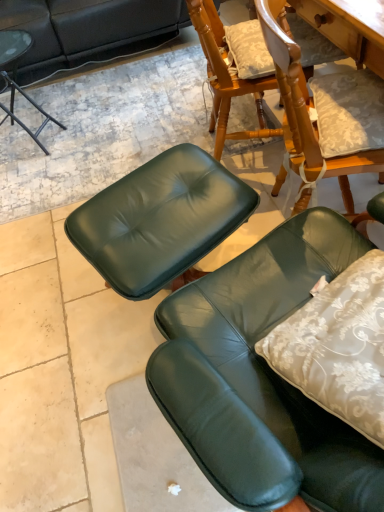
The height and width of the screenshot is (512, 384). What do you see at coordinates (261, 377) in the screenshot? I see `green leather chair at lower right, positioned as the first chair in right-to-left order` at bounding box center [261, 377].

In order to click on green leather chair at lower right, marked as the second chair in a left-to-right arrangement in this screenshot , I will do `click(261, 377)`.

The height and width of the screenshot is (512, 384). In order to click on matte black side table at upper left, which is the 2th chair from bottom to top in this screenshot , I will do `click(15, 77)`.

This screenshot has height=512, width=384. What do you see at coordinates (15, 77) in the screenshot? I see `matte black side table at upper left, marked as the first chair in a back-to-front arrangement` at bounding box center [15, 77].

The image size is (384, 512). Identify the location of green leather chair at lower right, which appears as the 2th chair when viewed from the back. (261, 377).

Does green leather chair at lower right, marked as the second chair in a left-to-right arrangement, appear on the right side of matte black side table at upper left, the 1th chair when ordered from left to right?

Yes.

Relative to matte black side table at upper left, positioned as the first chair in top-to-bottom order, is green leather chair at lower right, the 1th chair from the bottom, in front or behind?

Visually, green leather chair at lower right, the 1th chair from the bottom, is located in front of matte black side table at upper left, positioned as the first chair in top-to-bottom order.

Does point (300, 433) lie in front of point (21, 89)?

Yes, it is in front of point (21, 89).

In the scene shown: From the image's perspective, which is below, green leather chair at lower right, the 1th chair from the bottom, or matte black side table at upper left, the 1th chair when ordered from left to right?

From the image's view, green leather chair at lower right, the 1th chair from the bottom, is below.

From a real-world perspective, relative to matte black side table at upper left, marked as the first chair in a back-to-front arrangement, is green leather chair at lower right, marked as the second chair in a left-to-right arrangement, vertically above or below?

green leather chair at lower right, marked as the second chair in a left-to-right arrangement, is above matte black side table at upper left, marked as the first chair in a back-to-front arrangement.

Consider the image. Does green leather chair at lower right, marked as the second chair in a left-to-right arrangement, have a lesser width compared to matte black side table at upper left, marked as the second chair in a right-to-left arrangement?

Correct, the width of green leather chair at lower right, marked as the second chair in a left-to-right arrangement, is less than that of matte black side table at upper left, marked as the second chair in a right-to-left arrangement.

Who is taller, green leather chair at lower right, the 1th chair from the bottom, or matte black side table at upper left, which is the 2th chair from bottom to top?

green leather chair at lower right, the 1th chair from the bottom, is taller.

Is green leather chair at lower right, which is the 2th chair from top to bottom, smaller than matte black side table at upper left, which appears as the 2th chair when viewed from the front?

Correct, green leather chair at lower right, which is the 2th chair from top to bottom, occupies less space than matte black side table at upper left, which appears as the 2th chair when viewed from the front.

Is green leather chair at lower right, positioned as the first chair in right-to-left order, surrounding matte black side table at upper left, which appears as the 2th chair when viewed from the front?

No, green leather chair at lower right, positioned as the first chair in right-to-left order, does not contain matte black side table at upper left, which appears as the 2th chair when viewed from the front.

Is green leather chair at lower right, which is the 2th chair from top to bottom, beside matte black side table at upper left, which is the 2th chair from bottom to top?

There is a gap between green leather chair at lower right, which is the 2th chair from top to bottom, and matte black side table at upper left, which is the 2th chair from bottom to top.

Is green leather chair at lower right, which is the 2th chair from top to bottom, facing towards matte black side table at upper left, marked as the first chair in a back-to-front arrangement?

Yes, green leather chair at lower right, which is the 2th chair from top to bottom, is oriented towards matte black side table at upper left, marked as the first chair in a back-to-front arrangement.

How different are the orientations of green leather chair at lower right, the 1th chair from the bottom, and matte black side table at upper left, marked as the first chair in a back-to-front arrangement, in degrees?

The angular difference between green leather chair at lower right, the 1th chair from the bottom, and matte black side table at upper left, marked as the first chair in a back-to-front arrangement, is 69.9 degrees.

Measure the distance between green leather chair at lower right, which is the 2th chair from top to bottom, and matte black side table at upper left, which appears as the 2th chair when viewed from the front.

A distance of 5.89 feet exists between green leather chair at lower right, which is the 2th chair from top to bottom, and matte black side table at upper left, which appears as the 2th chair when viewed from the front.

You are a GUI agent. You are given a task and a screenshot of the screen. Output one action in this format:
    pyautogui.click(x=<x>, y=<y>)
    Task: Click on the chair above the green leather chair at lower right, marked as the second chair in a left-to-right arrangement (from the image's perspective)
    
    Given the screenshot: What is the action you would take?
    pyautogui.click(x=15, y=77)

From the picture: Which is more to the right, matte black side table at upper left, marked as the first chair in a back-to-front arrangement, or green leather chair at lower right, marked as the second chair in a left-to-right arrangement?

Positioned to the right is green leather chair at lower right, marked as the second chair in a left-to-right arrangement.

Relative to green leather chair at lower right, marked as the second chair in a left-to-right arrangement, is matte black side table at upper left, which appears as the 2th chair when viewed from the front, in front or behind?

Visually, matte black side table at upper left, which appears as the 2th chair when viewed from the front, is located behind green leather chair at lower right, marked as the second chair in a left-to-right arrangement.

Which is less distant, (12, 108) or (184, 294)?

Point (12, 108) is farther from the camera than point (184, 294).

From the picture: From the image's perspective, who appears lower, matte black side table at upper left, which appears as the 2th chair when viewed from the front, or green leather chair at lower right, marked as the second chair in a left-to-right arrangement?

green leather chair at lower right, marked as the second chair in a left-to-right arrangement, is shown below in the image.

From a real-world perspective, is matte black side table at upper left, marked as the first chair in a back-to-front arrangement, physically located above or below green leather chair at lower right, the 1th chair from the bottom?

Clearly, from a real-world perspective, matte black side table at upper left, marked as the first chair in a back-to-front arrangement, is below green leather chair at lower right, the 1th chair from the bottom.

Looking at their sizes, would you say matte black side table at upper left, marked as the first chair in a back-to-front arrangement, is wider or thinner than green leather chair at lower right, marked as the second chair in a left-to-right arrangement?

Considering their sizes, matte black side table at upper left, marked as the first chair in a back-to-front arrangement, looks broader than green leather chair at lower right, marked as the second chair in a left-to-right arrangement.

Which of these two, matte black side table at upper left, which is the 2th chair from bottom to top, or green leather chair at lower right, the 1th chair from the bottom, stands taller?

green leather chair at lower right, the 1th chair from the bottom.

Who is smaller, matte black side table at upper left, which appears as the 2th chair when viewed from the front, or green leather chair at lower right, which appears as the 2th chair when viewed from the back?

green leather chair at lower right, which appears as the 2th chair when viewed from the back, is smaller.

Is matte black side table at upper left, positioned as the first chair in top-to-bottom order, not inside green leather chair at lower right, which appears as the 2th chair when viewed from the back?

Absolutely, matte black side table at upper left, positioned as the first chair in top-to-bottom order, is external to green leather chair at lower right, which appears as the 2th chair when viewed from the back.

Is matte black side table at upper left, positioned as the first chair in top-to-bottom order, in contact with green leather chair at lower right, marked as the second chair in a left-to-right arrangement?

No.

Is matte black side table at upper left, which appears as the 2th chair when viewed from the front, oriented away from green leather chair at lower right, the 1th chair from the bottom?

No.

How many degrees apart are the facing directions of matte black side table at upper left, marked as the first chair in a back-to-front arrangement, and green leather chair at lower right, positioned as the first chair in right-to-left order?

69.9 degrees.

Could you measure the distance between matte black side table at upper left, positioned as the first chair in top-to-bottom order, and green leather chair at lower right, the 1th chair from the bottom?

The distance of matte black side table at upper left, positioned as the first chair in top-to-bottom order, from green leather chair at lower right, the 1th chair from the bottom, is 1.80 meters.

Where is `chair above the green leather chair at lower right, which appears as the 2th chair when viewed from the back (from the image's perspective)`? chair above the green leather chair at lower right, which appears as the 2th chair when viewed from the back (from the image's perspective) is located at coordinates (15, 77).

What are the coordinates of `chair that appears below the green leather chair at lower right, which is the first chair from front to back (from a real-world perspective)` in the screenshot? It's located at (15, 77).

The height and width of the screenshot is (512, 384). Find the location of `chair below the matte black side table at upper left, marked as the second chair in a right-to-left arrangement (from the image's perspective)`. chair below the matte black side table at upper left, marked as the second chair in a right-to-left arrangement (from the image's perspective) is located at coordinates (261, 377).